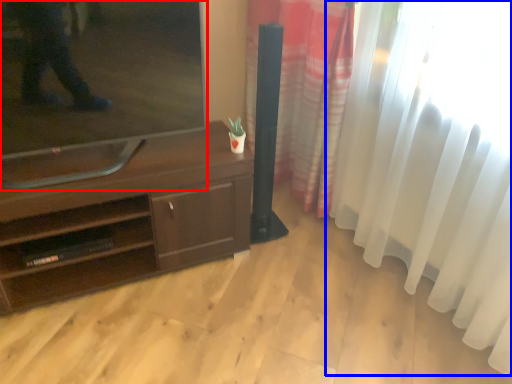
Question: Which point is further to the camera, television (highlighted by a red box) or curtain (highlighted by a blue box)?

Choices:
 (A) television
 (B) curtain

Answer: (A)